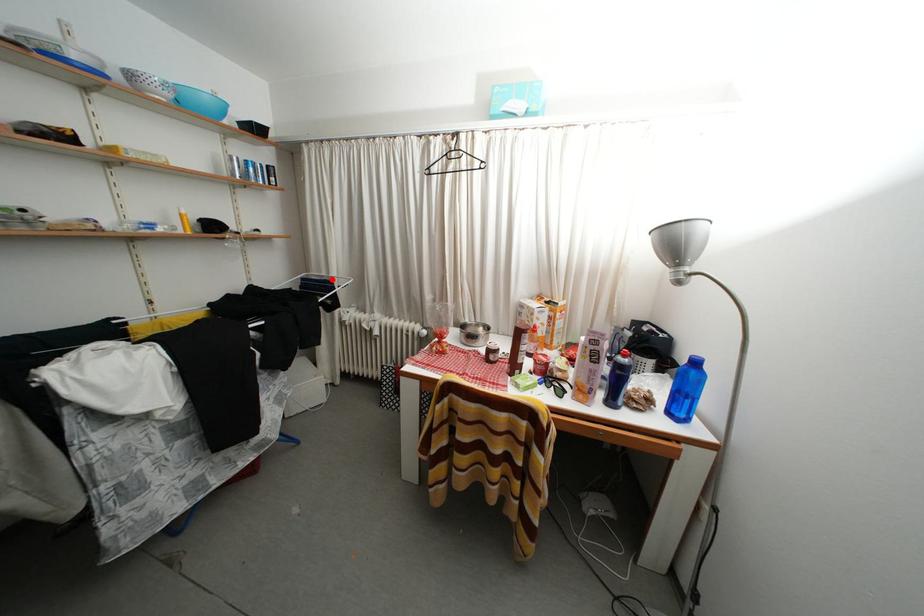
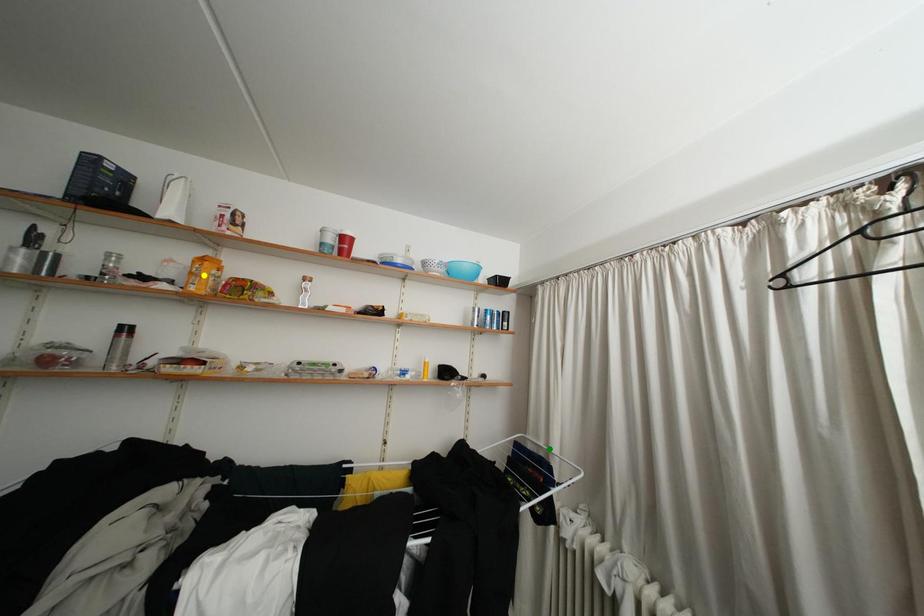
Question: I am providing you with two images of the same scene from different viewpoints. A red point is marked on the first image. You are given multiple points on the second image. Can you choose the point in image 2 that corresponds to the point in image 1?

Choices:
 (A) blue point
 (B) yellow point
 (C) green point

Answer: (C)